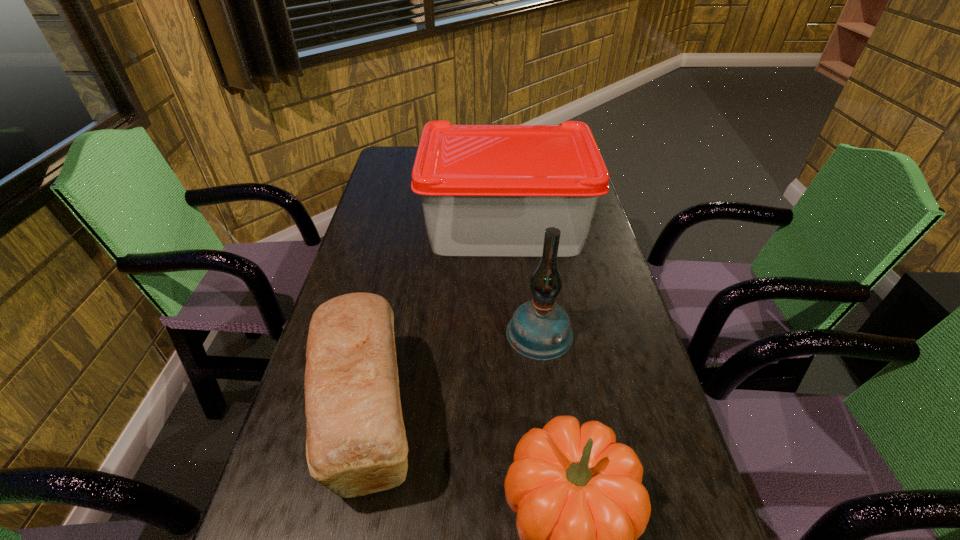
In order to click on oil lamp in this screenshot , I will do `click(540, 329)`.

Where is `tray`? The height and width of the screenshot is (540, 960). tray is located at coordinates (487, 190).

This screenshot has height=540, width=960. What are the coordinates of `bread` in the screenshot? It's located at (356, 444).

Image resolution: width=960 pixels, height=540 pixels. I want to click on free point located on the left of the oil lamp, so click(x=436, y=332).

At what (x,y) coordinates should I click in order to perform the action: click on free space located on the back of the tray. Please return your answer as a coordinate pair (x, y). The height and width of the screenshot is (540, 960). Looking at the image, I should click on (499, 150).

At what (x,y) coordinates should I click in order to perform the action: click on vacant space situated on the back of the bread. Please return your answer as a coordinate pair (x, y). The image size is (960, 540). Looking at the image, I should click on (389, 317).

The width and height of the screenshot is (960, 540). In order to click on object present at the left edge in this screenshot , I will do `click(356, 444)`.

You are a GUI agent. You are given a task and a screenshot of the screen. Output one action in this format:
    pyautogui.click(x=<x>, y=<y>)
    Task: Click on the oil lamp present at the right edge
    This screenshot has width=960, height=540.
    Given the screenshot: What is the action you would take?
    tap(540, 329)

Locate an element on the screen. This screenshot has width=960, height=540. tray present at the right edge is located at coordinates (487, 190).

Where is `free location at the left edge of the desktop`? free location at the left edge of the desktop is located at coordinates (380, 244).